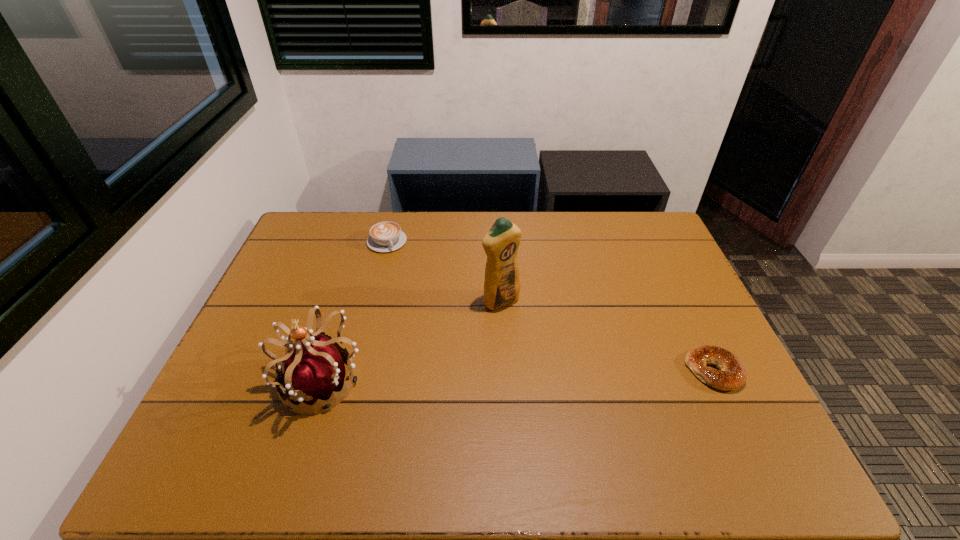
At what (x,y) coordinates should I click in order to perform the action: click on object positioned at the near left corner. Please return your answer as a coordinate pair (x, y). The height and width of the screenshot is (540, 960). Looking at the image, I should click on pyautogui.click(x=314, y=370).

What are the coordinates of `free spot at the far edge of the desktop` in the screenshot? It's located at (482, 247).

The height and width of the screenshot is (540, 960). In the image, there is a desktop. What are the coordinates of `vacant space at the near edge` in the screenshot? It's located at (625, 429).

Where is `free space at the left edge of the desktop`? Image resolution: width=960 pixels, height=540 pixels. free space at the left edge of the desktop is located at coordinates tap(265, 334).

Where is `vacant space at the right edge of the desktop`? The height and width of the screenshot is (540, 960). vacant space at the right edge of the desktop is located at coordinates (670, 366).

Find the location of a particular element. The height and width of the screenshot is (540, 960). blank space at the far right corner of the desktop is located at coordinates (615, 213).

In order to click on free space that is in between the tiara and the shortest object in this screenshot , I will do `click(517, 376)`.

Find the location of a particular element. The height and width of the screenshot is (540, 960). free point between the tiara and the third nearest object is located at coordinates (412, 341).

At what (x,y) coordinates should I click in order to perform the action: click on vacant region between the third nearest object and the farthest object. Please return your answer as a coordinate pair (x, y). Image resolution: width=960 pixels, height=540 pixels. Looking at the image, I should click on (444, 272).

The image size is (960, 540). I want to click on free area in between the second tallest object and the third tallest object, so click(x=354, y=312).